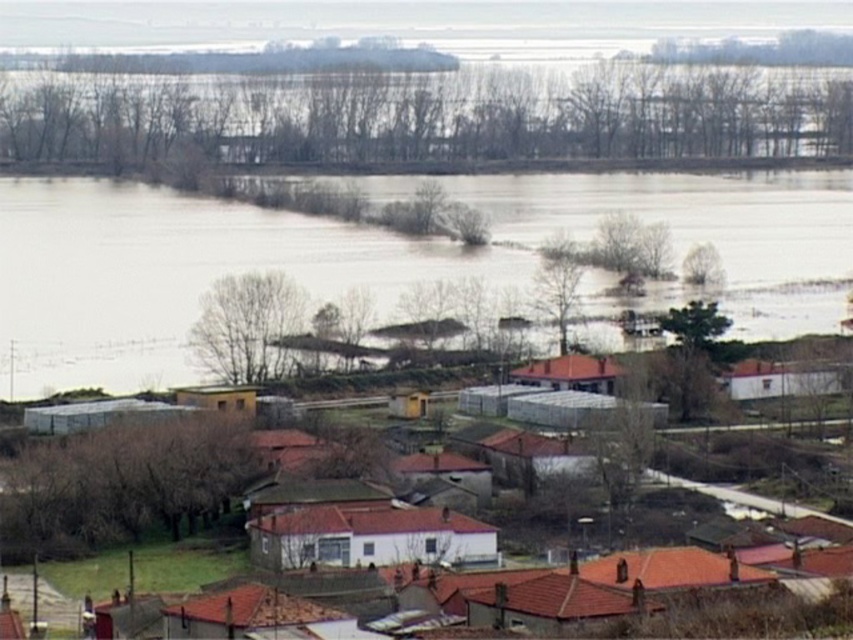
What do you see at coordinates (378, 259) in the screenshot? I see `brown muddy water at center` at bounding box center [378, 259].

What do you see at coordinates (378, 259) in the screenshot? I see `brown muddy water at center` at bounding box center [378, 259].

I want to click on brown muddy water at center, so click(378, 259).